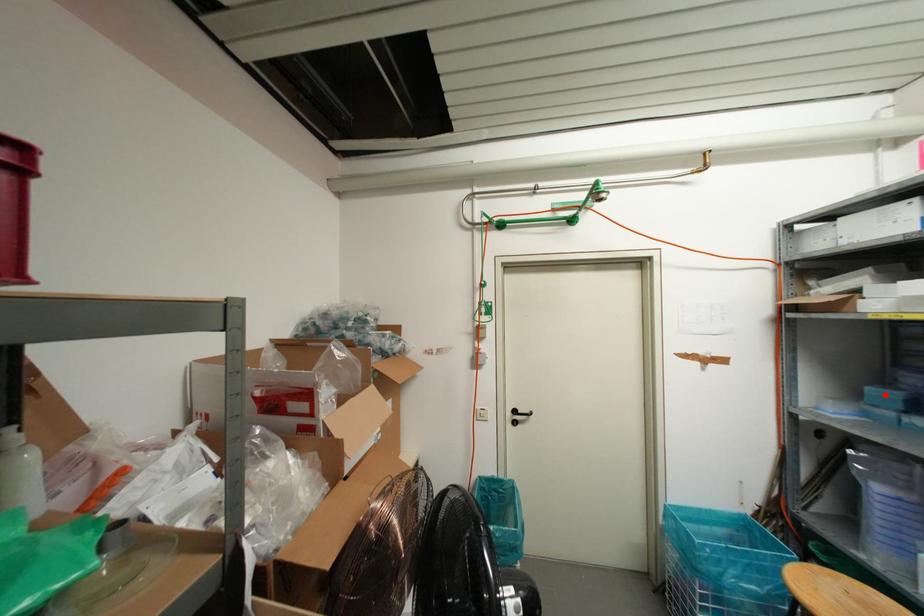
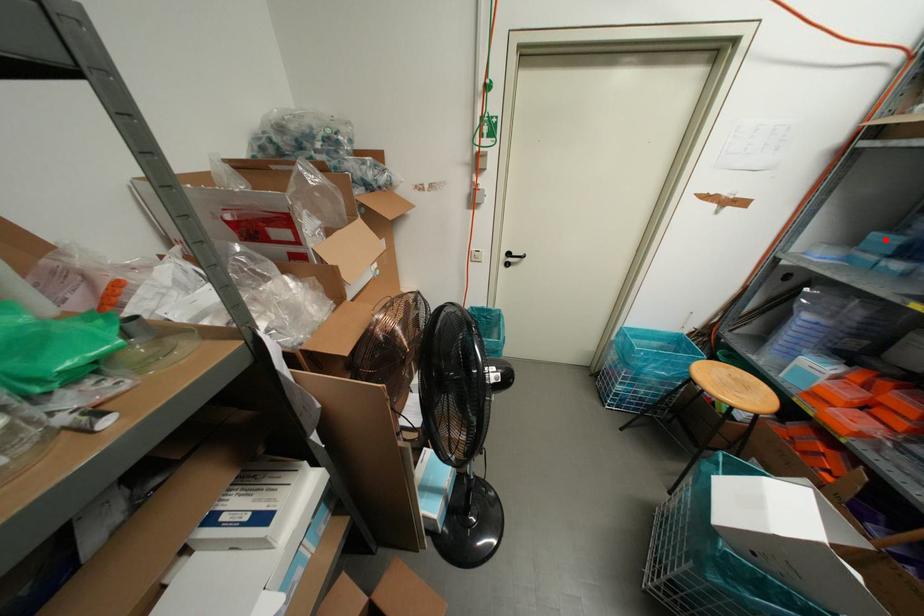
I am providing you with two images of the same scene from different viewpoints. A red point is marked on the first image and another point is marked on the second image. Are the points marked in image1 and image2 representing the same 3D position?

Yes